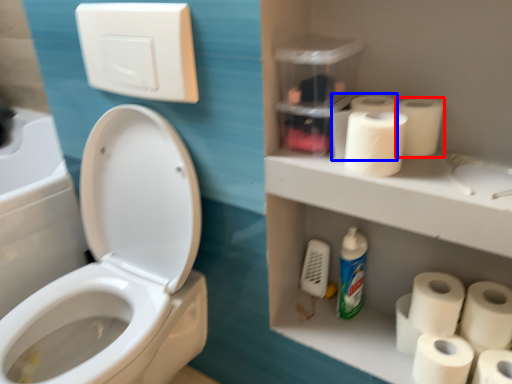
Question: Which of the following is the farthest to the observer, toilet paper (highlighted by a red box) or paper towel (highlighted by a blue box)?

Choices:
 (A) toilet paper
 (B) paper towel

Answer: (B)